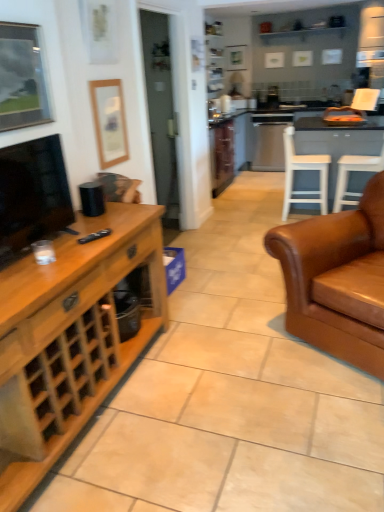
Question: Is black matte remote at center next to white plastic chair at right, which is the second chair from left to right, and touching it?

Choices:
 (A) yes
 (B) no

Answer: (B)

Question: Is white plastic chair at right, which is the second chair from left to right, at the back of black matte remote at center?

Choices:
 (A) no
 (B) yes

Answer: (A)

Question: Can white plastic chair at right, the 1th chair in the right-to-left sequence, be found inside black matte remote at center?

Choices:
 (A) no
 (B) yes

Answer: (A)

Question: From a real-world perspective, is black matte remote at center on white plastic chair at right, the 1th chair in the right-to-left sequence?

Choices:
 (A) no
 (B) yes

Answer: (B)

Question: Could you tell me if black matte remote at center is facing white plastic chair at right, the 1th chair in the right-to-left sequence?

Choices:
 (A) yes
 (B) no

Answer: (A)

Question: Relative to matte black tv at left, is wooden cabinet at left in front or behind?

Choices:
 (A) behind
 (B) front

Answer: (B)

Question: From the image's perspective, is wooden cabinet at left located above or below matte black tv at left?

Choices:
 (A) below
 (B) above

Answer: (A)

Question: Considering the positions of wooden cabinet at left and matte black tv at left in the image, is wooden cabinet at left bigger or smaller than matte black tv at left?

Choices:
 (A) small
 (B) big

Answer: (B)

Question: Which is correct: wooden cabinet at left is inside matte black tv at left, or outside of it?

Choices:
 (A) outside
 (B) inside

Answer: (A)

Question: In the image, is metallic silver picture frame at upper left, which is the second picture frame from back to front, positioned in front of or behind wooden picture frame at upper left, marked as the second picture frame in a front-to-back arrangement?

Choices:
 (A) behind
 (B) front

Answer: (B)

Question: Considering the relative positions of metallic silver picture frame at upper left, which is the second picture frame from back to front, and wooden picture frame at upper left, the first picture frame in the back-to-front sequence, in the image provided, is metallic silver picture frame at upper left, which is the second picture frame from back to front, to the left or to the right of wooden picture frame at upper left, the first picture frame in the back-to-front sequence,?

Choices:
 (A) right
 (B) left

Answer: (B)

Question: From a real-world perspective, is metallic silver picture frame at upper left, which is the second picture frame from back to front, above or below wooden picture frame at upper left, the first picture frame in the back-to-front sequence?

Choices:
 (A) above
 (B) below

Answer: (A)

Question: Which is correct: metallic silver picture frame at upper left, which is the second picture frame from back to front, is inside wooden picture frame at upper left, which is the first picture frame from right to left, or outside of it?

Choices:
 (A) outside
 (B) inside

Answer: (A)

Question: In terms of width, does white wood chair at center, positioned as the 1th chair in left-to-right order, look wider or thinner when compared to wooden picture frame at upper left, the 2th picture frame viewed from the left?

Choices:
 (A) wide
 (B) thin

Answer: (A)

Question: From the image's perspective, is white wood chair at center, positioned as the 1th chair in left-to-right order, located above or below wooden picture frame at upper left, the 2th picture frame viewed from the left?

Choices:
 (A) above
 (B) below

Answer: (B)